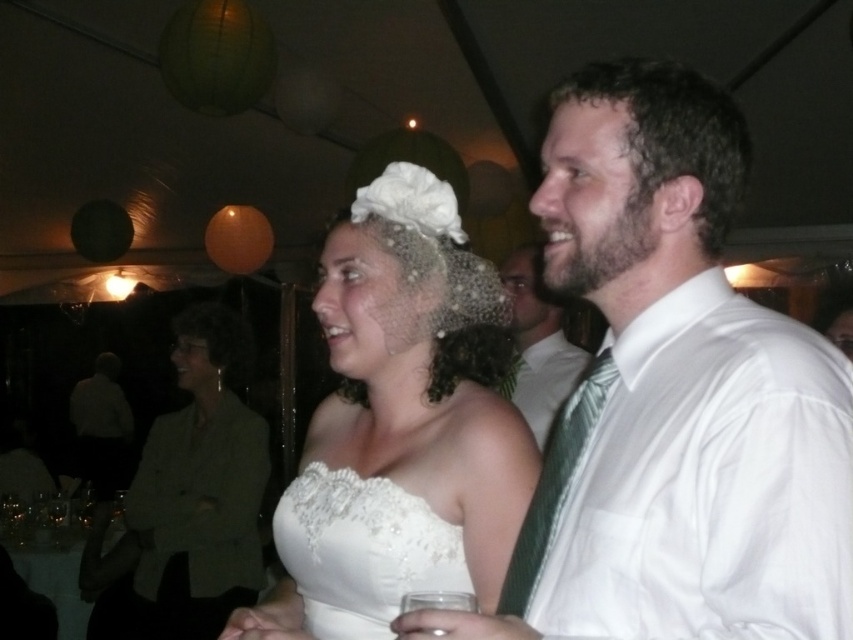
Between white lace dress at center and matte olive green blazer at center, which one is positioned lower?

Positioned lower is matte olive green blazer at center.

Is white lace dress at center above matte olive green blazer at center?

Yes, white lace dress at center is above matte olive green blazer at center.

Describe the element at coordinates (422, 374) in the screenshot. I see `white lace dress at center` at that location.

In order to click on white lace dress at center in this screenshot , I will do `click(422, 374)`.

Describe the element at coordinates (422, 374) in the screenshot. I see `white lace dress at center` at that location.

Between white lace dress at center and white satin shirt at right, which one has less height?

white satin shirt at right

Between point (383, 225) and point (558, 333), which one is positioned behind?

The point (558, 333) is more distant.

Image resolution: width=853 pixels, height=640 pixels. Find the location of `white lace dress at center`. white lace dress at center is located at coordinates (422, 374).

Can you confirm if matte olive green blazer at center is shorter than white satin shirt at right?

No, matte olive green blazer at center is not shorter than white satin shirt at right.

Does matte olive green blazer at center lie behind white satin shirt at right?

Yes, it is behind white satin shirt at right.

Does point (90, 621) lie behind point (541, 282)?

Yes, it is.

Where is `matte olive green blazer at center`? This screenshot has height=640, width=853. matte olive green blazer at center is located at coordinates (186, 502).